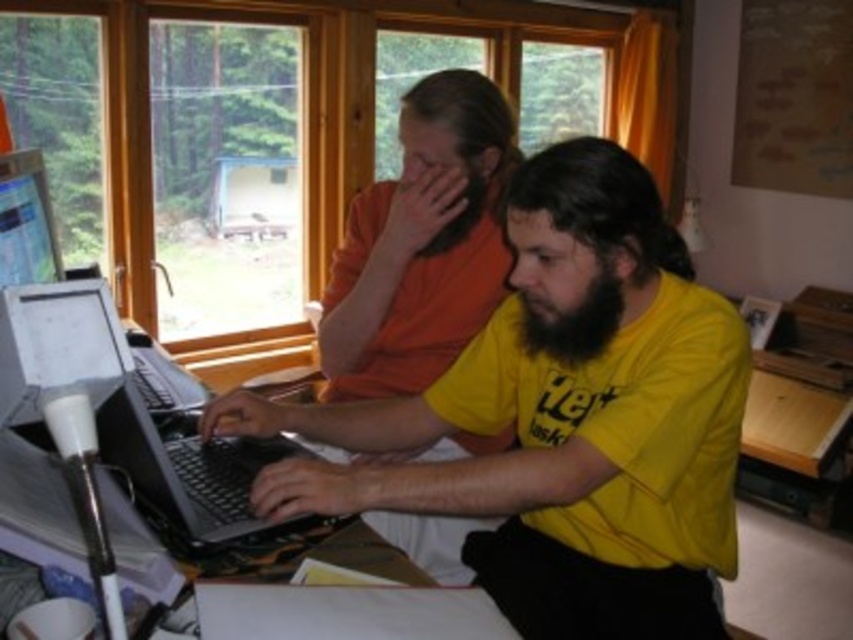
Does point (201, 401) lie behind point (589, 344)?

Yes, point (201, 401) is farther from viewer.

Does black plastic laptop at left have a greater height compared to black fuzzy beard at center?

Yes.

This screenshot has width=853, height=640. Find the location of `black plastic laptop at left`. black plastic laptop at left is located at coordinates (126, 406).

Does yellow matte shirt at center appear on the right side of orange matte shirt at center?

Indeed, yellow matte shirt at center is positioned on the right side of orange matte shirt at center.

Can you confirm if yellow matte shirt at center is bigger than orange matte shirt at center?

Yes.

Who is more distant from viewer, [711,625] or [517,161]?

The point [517,161] is more distant.

This screenshot has width=853, height=640. I want to click on yellow matte shirt at center, so click(x=561, y=422).

Does point (480, 346) come behind point (543, 317)?

Yes, point (480, 346) is behind point (543, 317).

Looking at this image, between yellow matte shirt at center and black fuzzy beard at center, which one appears on the left side from the viewer's perspective?

yellow matte shirt at center

What are the coordinates of `yellow matte shirt at center` in the screenshot? It's located at (561, 422).